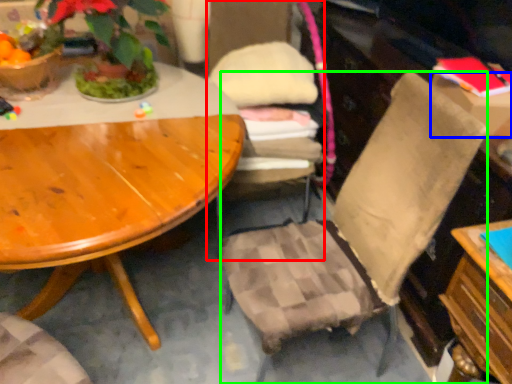
Question: Considering the real-world distances, which object is closest to chair (highlighted by a red box)? box (highlighted by a blue box) or chair (highlighted by a green box).

Choices:
 (A) box
 (B) chair

Answer: (B)